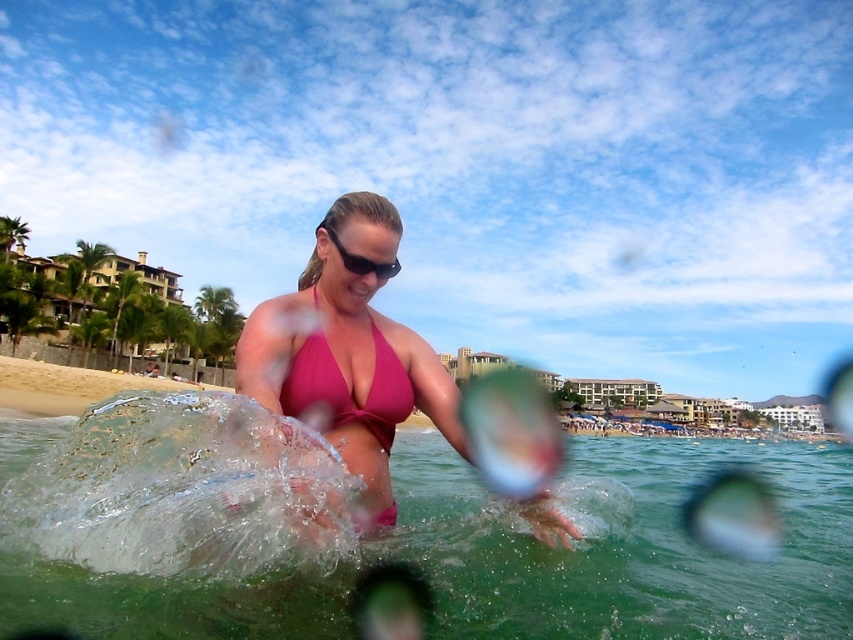
You are a photographer trying to capture a clear shot of the pink matte bikini at center and the black plastic sunglasses at center. Since you want to focus on the bikini, which object should you adjust your camera to prioritize in terms of size in the frame?

The pink matte bikini at center has a greater height compared to the black plastic sunglasses at center, so you should prioritize focusing on the pink matte bikini at center as it is larger in the frame.